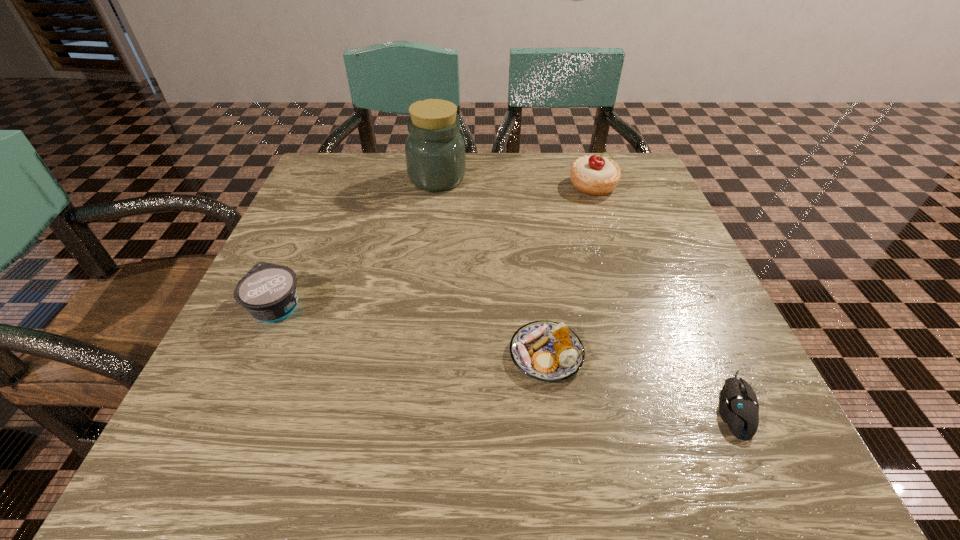
Locate an element on the screen. The image size is (960, 540). free space located on the right of the tallest object is located at coordinates (631, 179).

Identify the location of vacant region located 0.280m on the front of the taller pastry. This screenshot has width=960, height=540. (627, 286).

This screenshot has width=960, height=540. Identify the location of vacant area located on the back of the leftmost object. (322, 206).

The height and width of the screenshot is (540, 960). I want to click on vacant space located on the front of the left pastry, so click(x=559, y=452).

Where is `vacant space located 0.100m on the back of the computer mouse`? The image size is (960, 540). vacant space located 0.100m on the back of the computer mouse is located at coordinates (697, 322).

Where is `jar situated at the far edge`? The height and width of the screenshot is (540, 960). jar situated at the far edge is located at coordinates (435, 156).

Where is `pastry situated at the far edge`? The height and width of the screenshot is (540, 960). pastry situated at the far edge is located at coordinates (595, 175).

The width and height of the screenshot is (960, 540). In order to click on object present at the near edge in this screenshot , I will do `click(738, 407)`.

Locate an element on the screen. This screenshot has height=540, width=960. object that is at the left edge is located at coordinates (268, 292).

Identify the location of pastry present at the right edge. (595, 175).